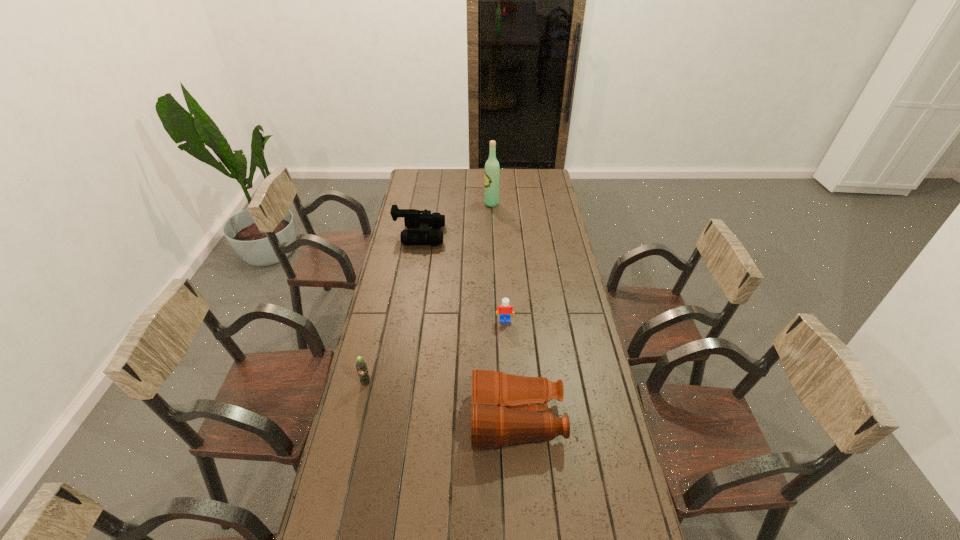
The height and width of the screenshot is (540, 960). I want to click on the farthest object, so click(x=492, y=168).

Locate an element on the screen. This screenshot has height=540, width=960. the tallest object is located at coordinates (492, 168).

Locate an element on the screen. Image resolution: width=960 pixels, height=540 pixels. the farther binoculars is located at coordinates (413, 219).

Locate an element on the screen. the fourth nearest object is located at coordinates (413, 219).

At what (x,y) coordinates should I click in order to perform the action: click on the right binoculars. Please return your answer as a coordinate pair (x, y). Looking at the image, I should click on 497,420.

Locate an element on the screen. soda is located at coordinates (361, 365).

Locate an element on the screen. Image resolution: width=960 pixels, height=540 pixels. the third nearest object is located at coordinates (505, 309).

Locate an element on the screen. The height and width of the screenshot is (540, 960). Lego is located at coordinates (505, 309).

I want to click on free space located 0.230m on the front-facing side of the farthest object, so click(x=442, y=204).

Locate an element on the screen. vacant space located on the front-facing side of the farthest object is located at coordinates (468, 204).